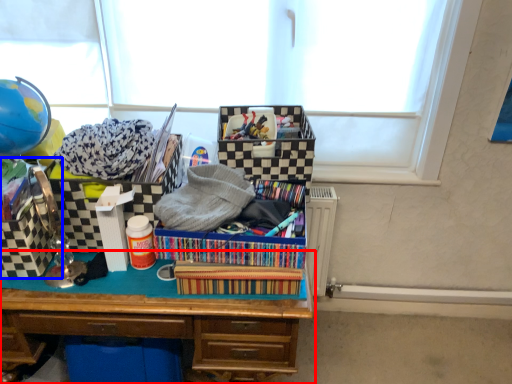
Question: Among these objects, which one is farthest to the camera, desk (highlighted by a red box) or storage box (highlighted by a blue box)?

Choices:
 (A) desk
 (B) storage box

Answer: (B)